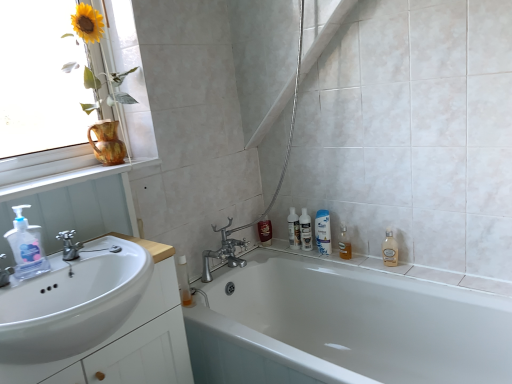
Find the location of a particular element. The height and width of the screenshot is (384, 512). vacant space behind translucent plastic bottle at lower left is located at coordinates (205, 284).